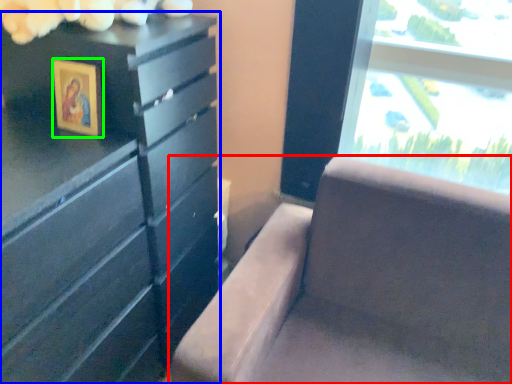
Question: Estimate the real-world distances between objects in this image. Which object is farther from furniture (highlighted by a red box), chest of drawers (highlighted by a blue box) or picture frame (highlighted by a green box)?

Choices:
 (A) chest of drawers
 (B) picture frame

Answer: (B)